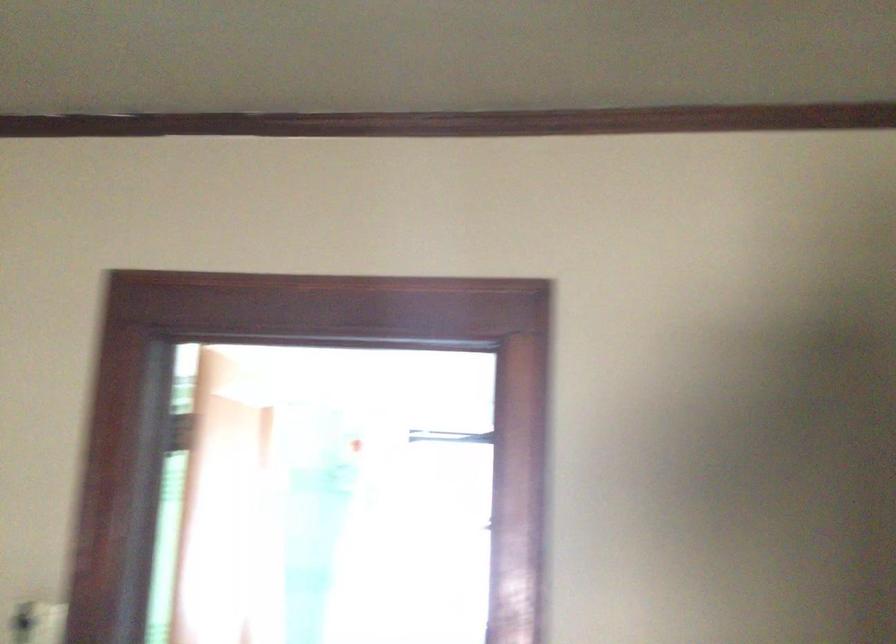
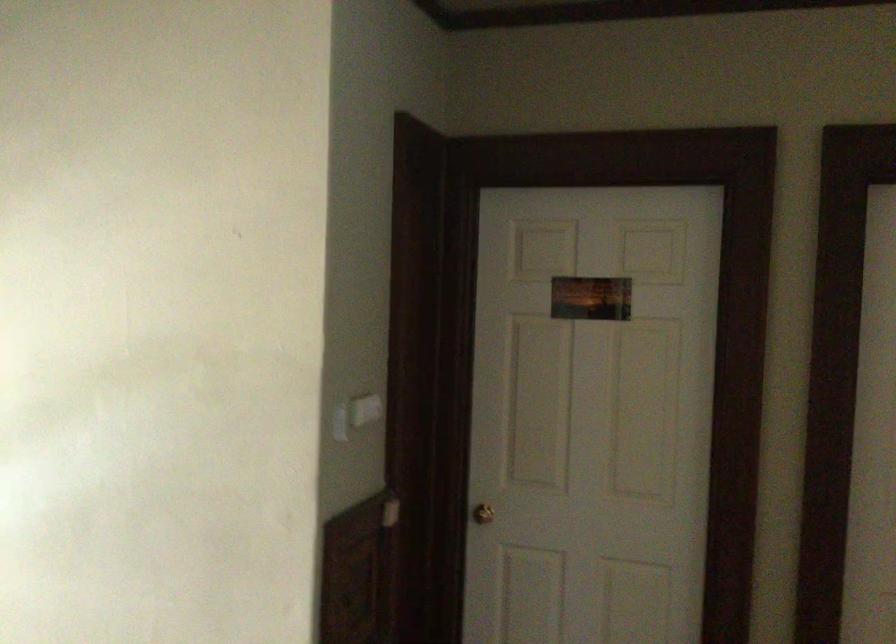
Question: Based on the continuous images, in which direction is the camera rotating? Reply with the corresponding letter.

Choices:
 (A) Left
 (B) Right
 (C) Up
 (D) Down

Answer: (A)